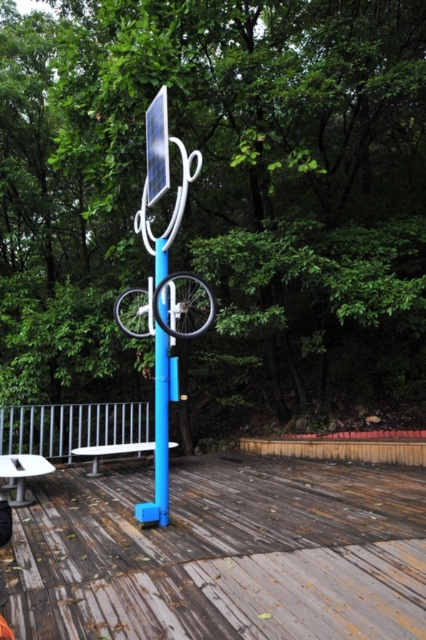
You are standing in the park and see the point at coordinates (221, 554). Is this point located on the wooden deck at center?

Yes, the point at (221, 554) is on the wooden deck at center.

You are standing at the entrance of the park and want to locate both the wooden deck at center and the black matte bicycle at center. According to the scene, which object is located to the right of the other?

The wooden deck at center is positioned on the right side of black matte bicycle at center, so the wooden deck at center is to the right of the black matte bicycle at center.